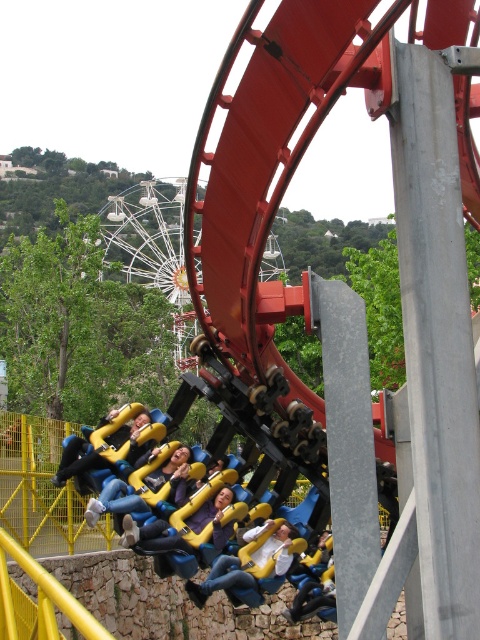
Question: Which object is the farthest from the yellow plastic helmet at center?

Choices:
 (A) denim jeans at center
 (B) yellow plastic seat at center
 (C) yellow fabric seat at center

Answer: (B)

Question: Is yellow plastic helmet at center to the right of yellow plastic seat at center from the viewer's perspective?

Choices:
 (A) no
 (B) yes

Answer: (B)

Question: Is yellow plastic helmet at center bigger than yellow plastic seat at center?

Choices:
 (A) no
 (B) yes

Answer: (B)

Question: Is yellow fabric seat at center behind yellow plastic seat at center?

Choices:
 (A) no
 (B) yes

Answer: (A)

Question: Which is farther from the denim jeans at center?

Choices:
 (A) yellow plastic helmet at center
 (B) yellow fabric seat at center
 (C) yellow plastic seat at center

Answer: (C)

Question: Which point appears closest to the camera in this image?

Choices:
 (A) (108, 481)
 (B) (96, 465)
 (C) (144, 548)
 (D) (211, 589)

Answer: (C)